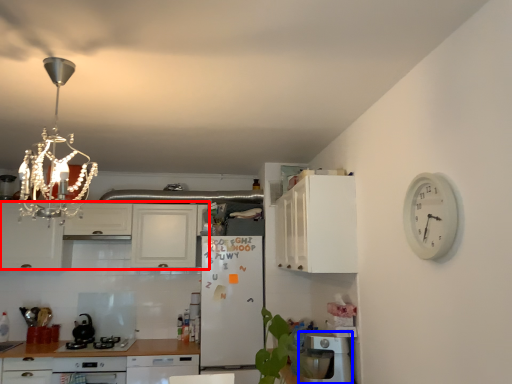
Question: Among these objects, which one is farthest to the camera, cabinetry (highlighted by a red box) or dish washer (highlighted by a blue box)?

Choices:
 (A) cabinetry
 (B) dish washer

Answer: (A)